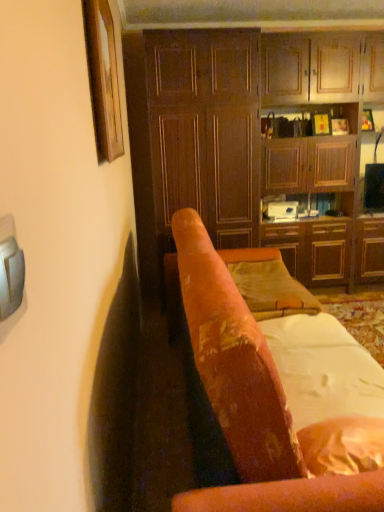
Question: Does wooden picture frame at upper left contain wooden cabinet at right?

Choices:
 (A) no
 (B) yes

Answer: (A)

Question: From a real-world perspective, is wooden picture frame at upper left positioned under wooden cabinet at right based on gravity?

Choices:
 (A) no
 (B) yes

Answer: (A)

Question: Is wooden picture frame at upper left shorter than wooden cabinet at right?

Choices:
 (A) yes
 (B) no

Answer: (A)

Question: Is wooden picture frame at upper left not close to wooden cabinet at right?

Choices:
 (A) no
 (B) yes

Answer: (B)

Question: Is wooden picture frame at upper left positioned behind wooden cabinet at right?

Choices:
 (A) yes
 (B) no

Answer: (B)

Question: Is wooden picture frame at upper left placed right next to wooden cabinet at right?

Choices:
 (A) yes
 (B) no

Answer: (B)

Question: Is velvet orange pillow at center outside of wooden cabinet at right?

Choices:
 (A) yes
 (B) no

Answer: (A)

Question: From a real-world perspective, does velvet orange pillow at center sit lower than wooden cabinet at right?

Choices:
 (A) yes
 (B) no

Answer: (A)

Question: Is velvet orange pillow at center aimed at wooden cabinet at right?

Choices:
 (A) yes
 (B) no

Answer: (B)

Question: Is velvet orange pillow at center looking in the opposite direction of wooden cabinet at right?

Choices:
 (A) yes
 (B) no

Answer: (B)

Question: Is wooden cabinet at right completely or partially inside velvet orange pillow at center?

Choices:
 (A) no
 (B) yes

Answer: (A)

Question: Does velvet orange pillow at center have a greater height compared to wooden cabinet at right?

Choices:
 (A) yes
 (B) no

Answer: (B)

Question: Can you confirm if white soft fabric at center is bigger than velvet-like orange chair at center?

Choices:
 (A) no
 (B) yes

Answer: (A)